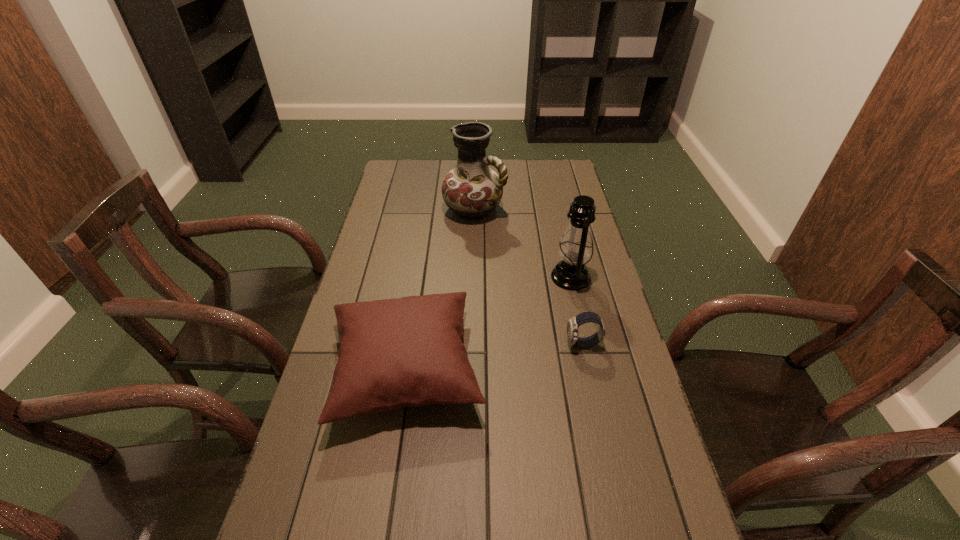
Where is `empty location between the second farthest object and the vase`? Image resolution: width=960 pixels, height=540 pixels. empty location between the second farthest object and the vase is located at coordinates (522, 244).

Identify the location of free space between the second farthest object and the watch. The height and width of the screenshot is (540, 960). (577, 310).

Select which object is the third closest to the cushion. Please provide its 2D coordinates. Your answer should be formatted as a tuple, i.e. [(x, y)], where the tuple contains the x and y coordinates of a point satisfying the conditions above.

[(472, 190)]

I want to click on object that can be found as the second closest to the cushion, so click(x=576, y=246).

This screenshot has height=540, width=960. I want to click on vacant region that satisfies the following two spatial constraints: 1. on the back side of the third nearest object; 2. on the left side of the cushion, so click(420, 277).